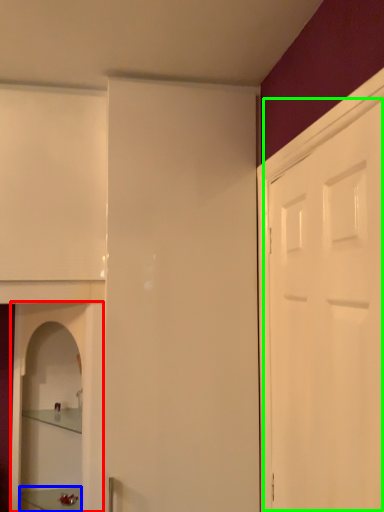
Question: Which object is the closest to the cabinetry (highlighted by a red box)? Choose among these: furniture (highlighted by a blue box) or door (highlighted by a green box).

Choices:
 (A) furniture
 (B) door

Answer: (A)